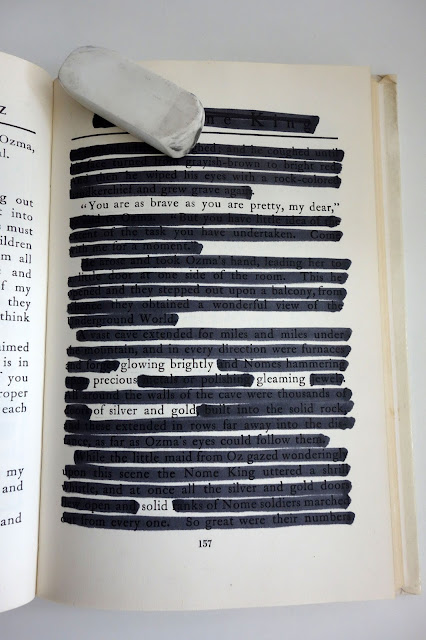
Find the location of a particular element. Image resolution: width=426 pixels, height=640 pixels. bottom right corner of book is located at coordinates coord(418,591).